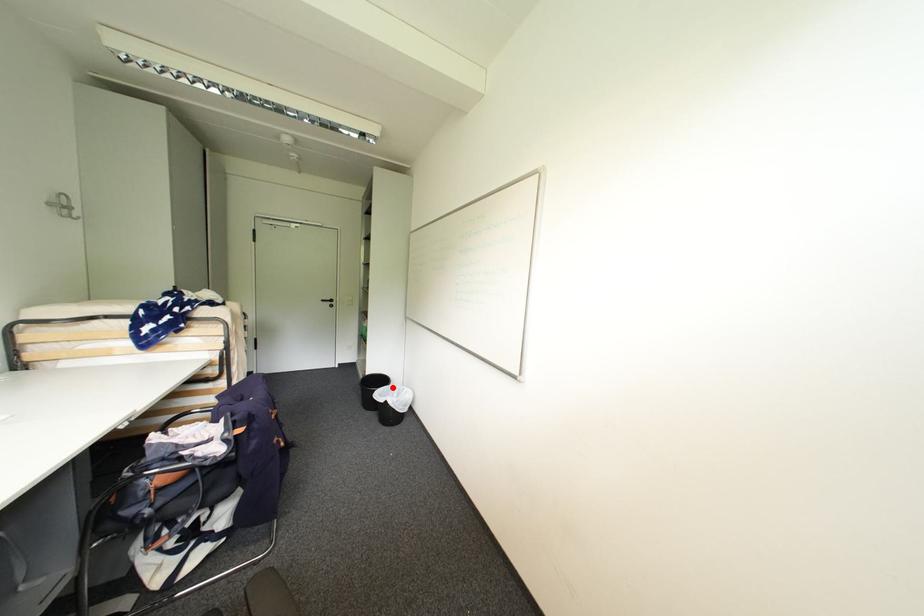
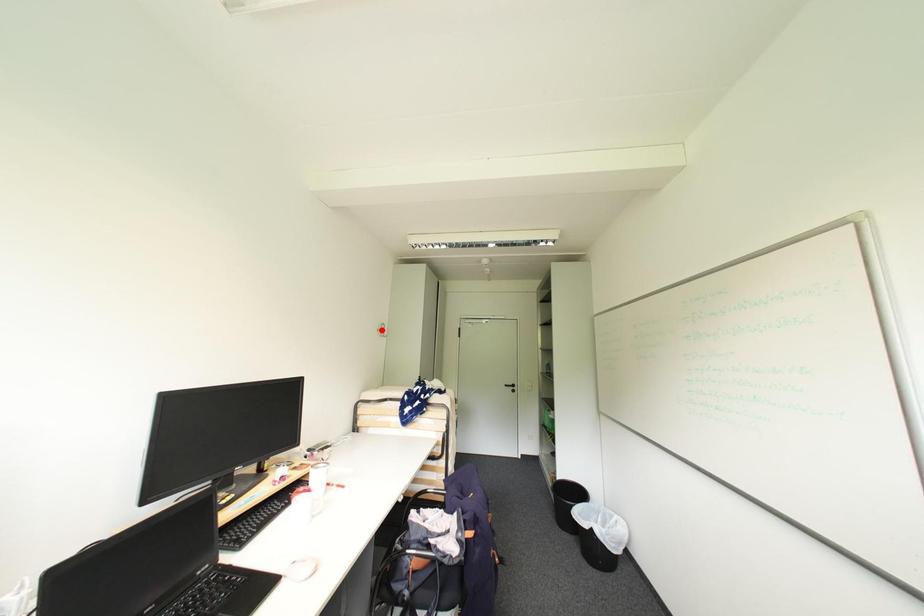
Consider the image. I am providing you with two images of the same scene from different viewpoints. A red point is marked on the first image and another point is marked on the second image. Are the points marked in image1 and image2 representing the same 3D position?

No